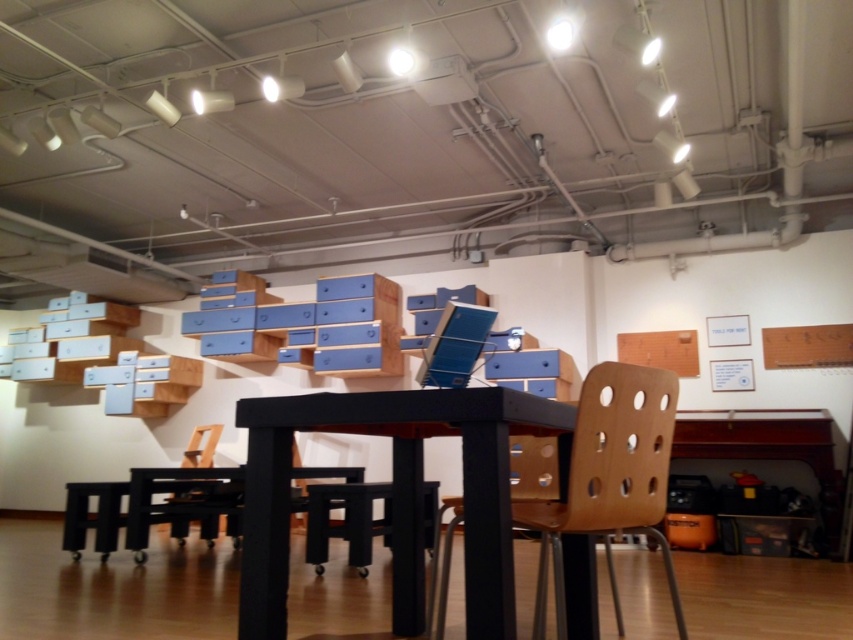
You are standing at the entrance of the studio and want to move towards the beech wood chair at center. Based on its 2D coordinates, in which general direction should you walk from your current position?

Since the beech wood chair at center is located at coordinates approximately 0.75 on the x and y axes, you should walk towards the center of the image to reach it.

You are organizing a small meeting in the studio and need to arrange seating. If you want to place a name tag on the beech wood chair at center and the matte black stool at center, which one should you place it on the right side of?

You should place the name tag on the right side of the matte black stool at center because the beech wood chair at center is positioned to its right.

Consider the image. You are setting up a small meeting area in this studio. You need to place a rectangular table between the beech wood chair at center and the black plastic stool at lower left. Based on their current positions, which side of the table should you place the table closer to?

The beech wood chair at center is positioned on the right side of black plastic stool at lower left, so the table should be placed closer to the right side of the black plastic stool at lower left to accommodate both seats.